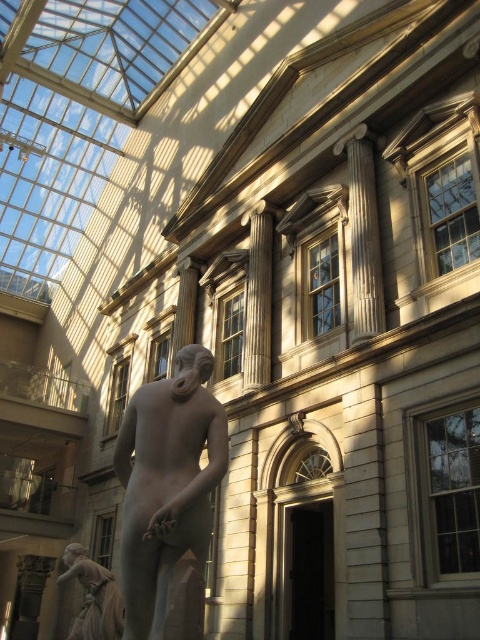
Which is more to the right, matte gray statue at center or matte bronze statue at lower left?

From the viewer's perspective, matte gray statue at center appears more on the right side.

Does matte gray statue at center appear on the right side of matte bronze statue at lower left?

Correct, you'll find matte gray statue at center to the right of matte bronze statue at lower left.

Is point (152, 410) positioned before point (112, 612)?

Yes.

Where is `matte gray statue at center`? matte gray statue at center is located at coordinates (167, 483).